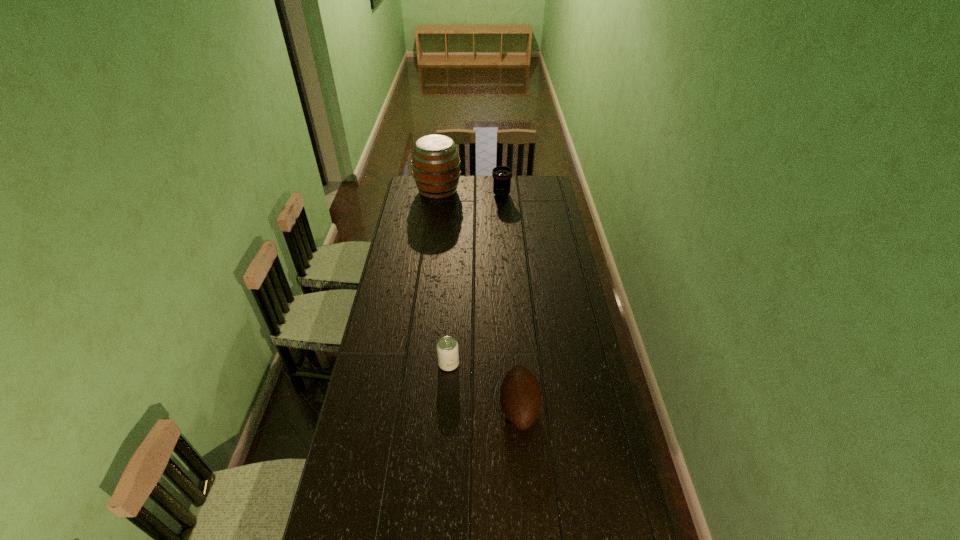
Locate an element on the screen. Image resolution: width=960 pixels, height=540 pixels. vacant area that lies between the cider and the soda can is located at coordinates (444, 278).

You are a GUI agent. You are given a task and a screenshot of the screen. Output one action in this format:
    pyautogui.click(x=<x>, y=<y>)
    Task: Click on the vacant space that is in between the soda can and the tallest object
    
    Given the screenshot: What is the action you would take?
    pyautogui.click(x=444, y=278)

I want to click on vacant area between the football and the cider, so click(479, 299).

You are a GUI agent. You are given a task and a screenshot of the screen. Output one action in this format:
    pyautogui.click(x=<x>, y=<y>)
    Task: Click on the free space between the telephoto lens and the third farthest object
    This screenshot has width=960, height=540.
    Given the screenshot: What is the action you would take?
    pyautogui.click(x=475, y=279)

At what (x,y) coordinates should I click in order to perform the action: click on free space between the third farthest object and the nearest object. Please return your answer as a coordinate pair (x, y). The height and width of the screenshot is (540, 960). Looking at the image, I should click on (484, 386).

Identify which object is located as the second nearest to the third farthest object. Please provide its 2D coordinates. Your answer should be formatted as a tuple, i.e. [(x, y)], where the tuple contains the x and y coordinates of a point satisfying the conditions above.

[(436, 166)]

Locate which object ranks in proximity to the telephoto lens. Please provide its 2D coordinates. Your answer should be formatted as a tuple, i.e. [(x, y)], where the tuple contains the x and y coordinates of a point satisfying the conditions above.

[(436, 166)]

You are a GUI agent. You are given a task and a screenshot of the screen. Output one action in this format:
    pyautogui.click(x=<x>, y=<y>)
    Task: Click on the free space that satisfies the following two spatial constraints: 1. on the front side of the tallest object; 2. on the left side of the telephoto lens
    
    Given the screenshot: What is the action you would take?
    pyautogui.click(x=438, y=195)

What are the coordinates of `vacant area that satisfies the following two spatial constraints: 1. on the front side of the cider; 2. on the left side of the telephoto lens` in the screenshot? It's located at (438, 195).